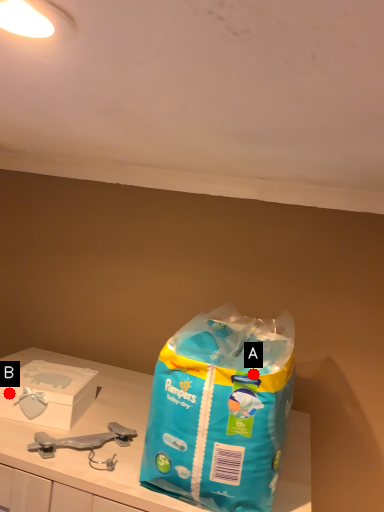
Question: Two points are circled on the image, labeled by A and B beside each circle. Which point is closer to the camera?

Choices:
 (A) A is closer
 (B) B is closer

Answer: (A)